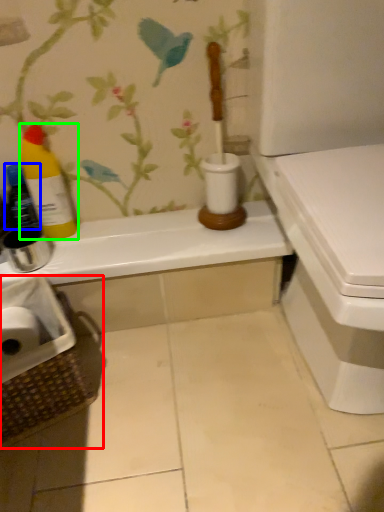
Question: Considering the real-world distances, which object is farthest from laundry basket (highlighted by a red box)? bottle (highlighted by a blue box) or bottle (highlighted by a green box)?

Choices:
 (A) bottle
 (B) bottle

Answer: (A)